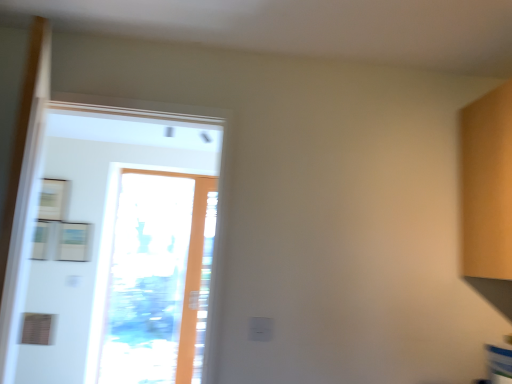
What do you see at coordinates (156, 280) in the screenshot? The width and height of the screenshot is (512, 384). I see `transparent glass door at center` at bounding box center [156, 280].

You are a GUI agent. You are given a task and a screenshot of the screen. Output one action in this format:
    pyautogui.click(x=<x>, y=<y>)
    Task: Click on the transparent glass door at center
    
    Given the screenshot: What is the action you would take?
    156,280

What is the approximate height of transparent glass door at center?

transparent glass door at center is 1.91 meters in height.

Describe the element at coordinates (110, 244) in the screenshot. I see `transparent glass screen door at left` at that location.

What is the approximate width of transparent glass screen door at left?

6.23 inches.

Find the location of a particular element. transparent glass screen door at left is located at coordinates (110, 244).

Locate an element on the screen. The image size is (512, 384). transparent glass door at center is located at coordinates (156, 280).

In the image, is transparent glass door at center on the left side or the right side of transparent glass screen door at left?

From the image, it's evident that transparent glass door at center is to the left of transparent glass screen door at left.

Looking at this image, considering the positions of objects transparent glass door at center and transparent glass screen door at left in the image provided, who is in front, transparent glass door at center or transparent glass screen door at left?

Positioned in front is transparent glass screen door at left.

Is point (122, 319) farther from camera compared to point (88, 366)?

Yes, point (122, 319) is farther from viewer.

From the image's perspective, is transparent glass door at center located above or below transparent glass screen door at left?

Based on their image positions, transparent glass door at center is located beneath transparent glass screen door at left.

From a real-world perspective, is transparent glass door at center positioned under transparent glass screen door at left based on gravity?

Yes, from a real-world perspective, transparent glass door at center is below transparent glass screen door at left.

Which of these two, transparent glass door at center or transparent glass screen door at left, is thinner?

transparent glass door at center.

Which of these two, transparent glass door at center or transparent glass screen door at left, stands taller?

Standing taller between the two is transparent glass door at center.

Is transparent glass door at center bigger or smaller than transparent glass screen door at left?

transparent glass door at center is smaller than transparent glass screen door at left.

Is transparent glass door at center located outside transparent glass screen door at left?

Indeed, transparent glass door at center is completely outside transparent glass screen door at left.

Is transparent glass door at center with transparent glass screen door at left?

Yes, transparent glass door at center and transparent glass screen door at left clearly make contact.

Is transparent glass door at center facing away from transparent glass screen door at left?

A: No, transparent glass door at center's orientation is not away from transparent glass screen door at left.

The height and width of the screenshot is (384, 512). What are the coordinates of `window below the transparent glass screen door at left (from a real-world perspective)` in the screenshot? It's located at (156, 280).

Would you say transparent glass screen door at left is to the left or to the right of transparent glass door at center in the picture?

In the image, transparent glass screen door at left appears on the right side of transparent glass door at center.

Is transparent glass screen door at left positioned behind transparent glass door at center?

No, it is not.

Is point (11, 379) farther from camera compared to point (141, 263)?

No.

From the image's perspective, between transparent glass screen door at left and transparent glass door at center, who is located below?

transparent glass door at center, from the image's perspective.

From a real-world perspective, is transparent glass screen door at left physically above transparent glass door at center?

Yes.

Is transparent glass screen door at left wider than transparent glass door at center?

Correct, the width of transparent glass screen door at left exceeds that of transparent glass door at center.

Is transparent glass screen door at left taller or shorter than transparent glass door at center?

transparent glass screen door at left is shorter than transparent glass door at center.

Can you confirm if transparent glass screen door at left is smaller than transparent glass door at center?

Incorrect, transparent glass screen door at left is not smaller in size than transparent glass door at center.

Could transparent glass door at center be considered to be inside transparent glass screen door at left?

No, transparent glass screen door at left does not contain transparent glass door at center.

Is transparent glass screen door at left directly adjacent to transparent glass door at center?

Yes.

Could you tell me if transparent glass screen door at left is turned towards transparent glass door at center?

No, transparent glass screen door at left does not turn towards transparent glass door at center.

You are a GUI agent. You are given a task and a screenshot of the screen. Output one action in this format:
    pyautogui.click(x=<x>, y=<y>)
    Task: Click on the screen door on the right of the transparent glass door at center
    
    Given the screenshot: What is the action you would take?
    110,244

Where is `screen door lying above the transparent glass door at center (from the image's perspective)`? This screenshot has height=384, width=512. screen door lying above the transparent glass door at center (from the image's perspective) is located at coordinates (110, 244).

Locate an element on the screen. window behind the transparent glass screen door at left is located at coordinates (156, 280).